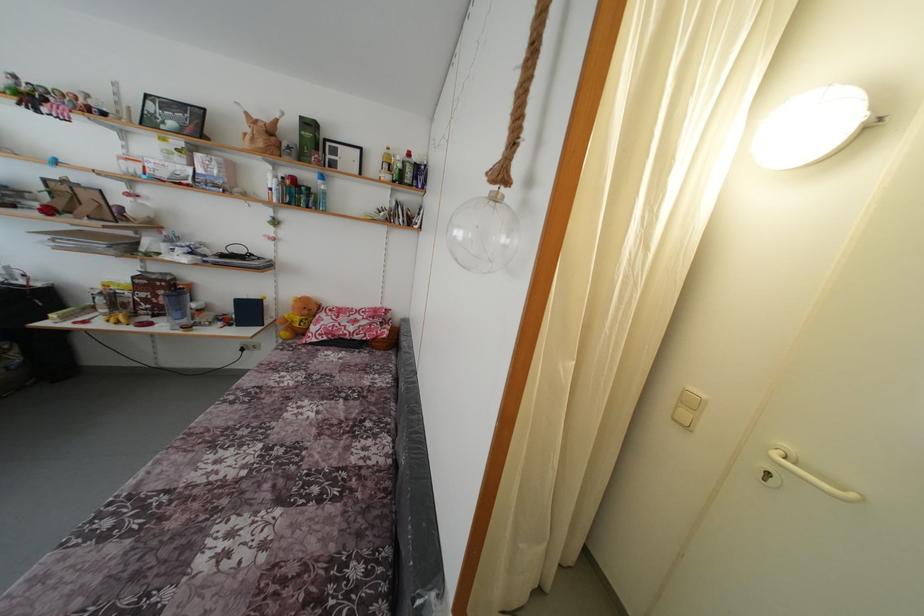
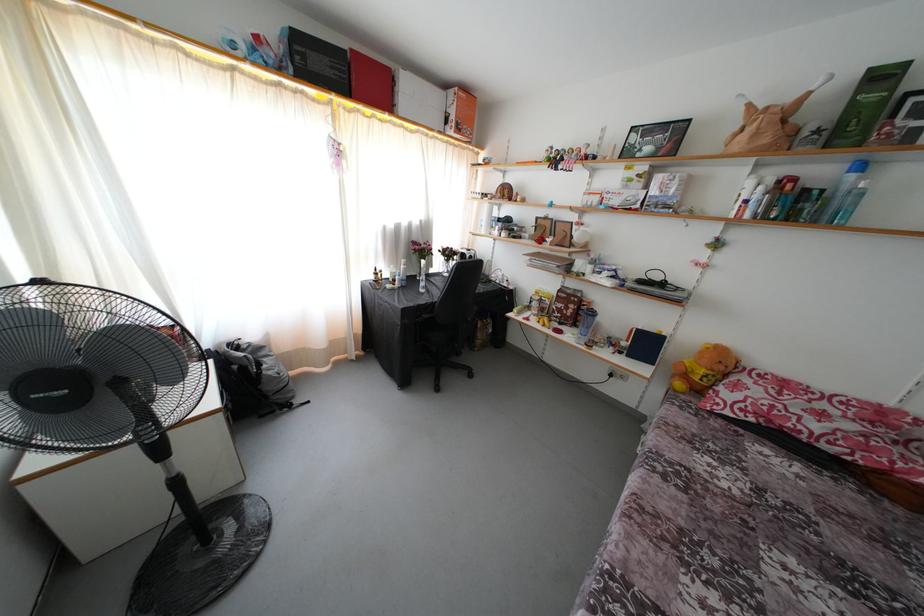
Where in the second image is the point corresponding to pixel 310 317 from the first image?

(726, 373)